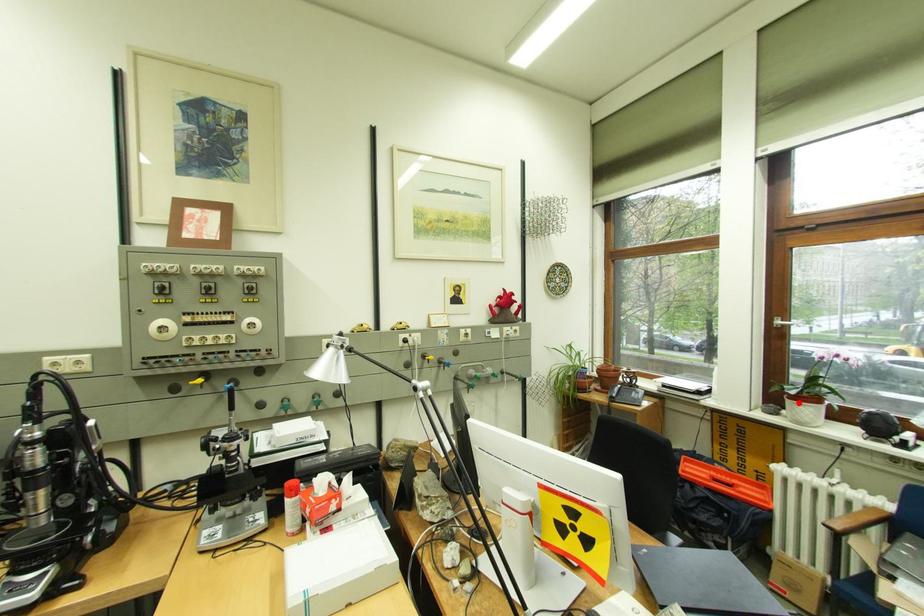
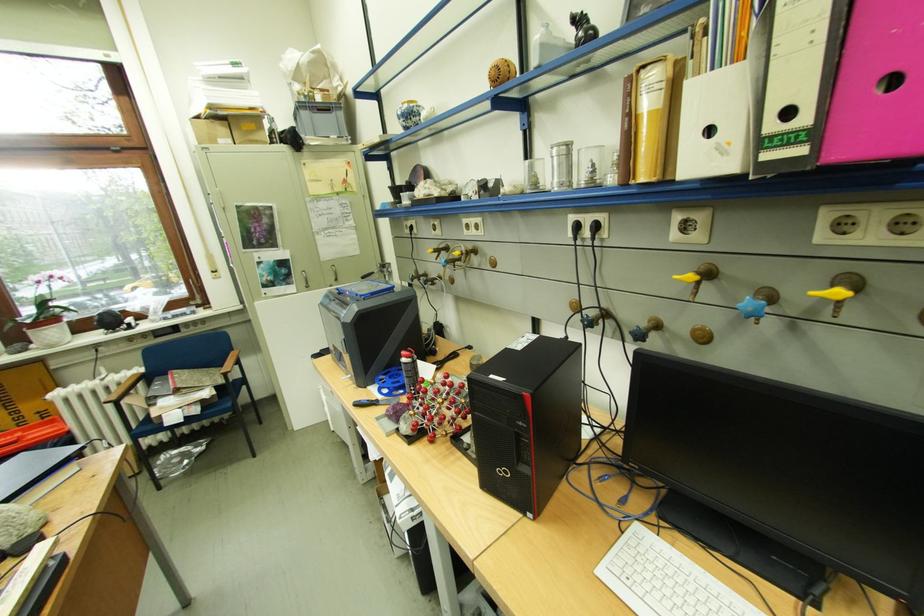
Find the pixel in the second image that matches the highlighted location in the first image.

(41, 334)